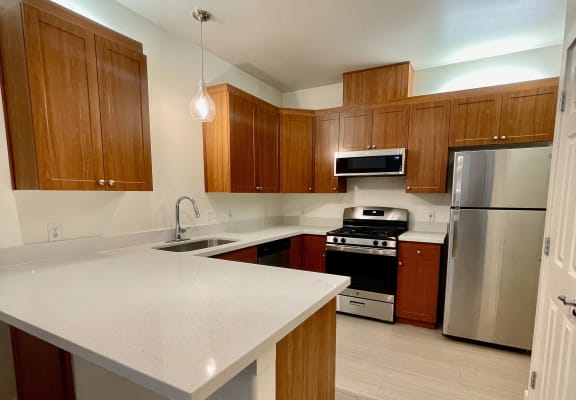
Locate an element on the screen. Image resolution: width=576 pixels, height=400 pixels. light is located at coordinates (200, 109).